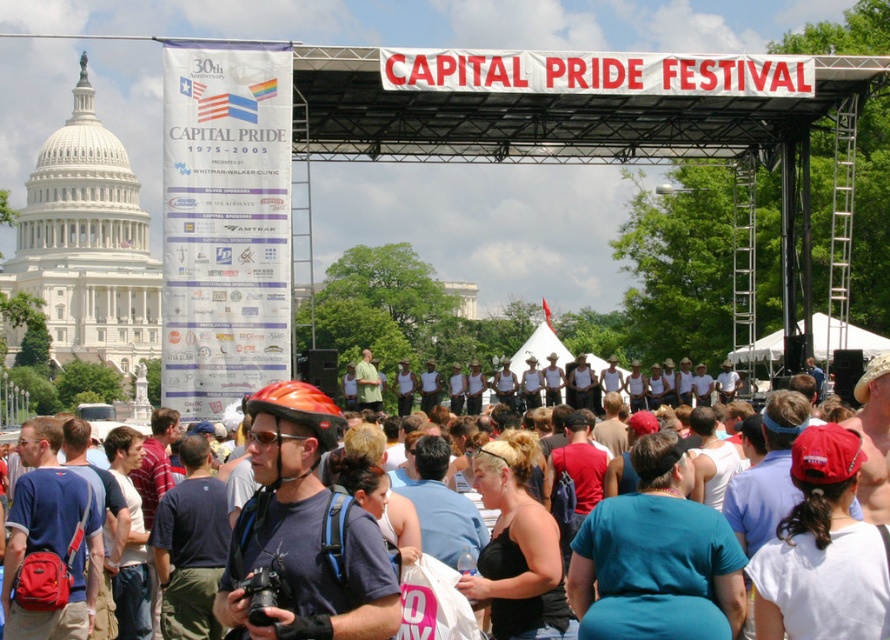
Is matte black tank tops at center below matte orange helmet at center?

Yes, matte black tank tops at center is below matte orange helmet at center.

Is point (719, 595) closer to camera compared to point (336, 426)?

That is False.

This screenshot has width=890, height=640. I want to click on matte black tank tops at center, so pos(816,440).

Locate an element on the screen. matte black tank tops at center is located at coordinates (816, 440).